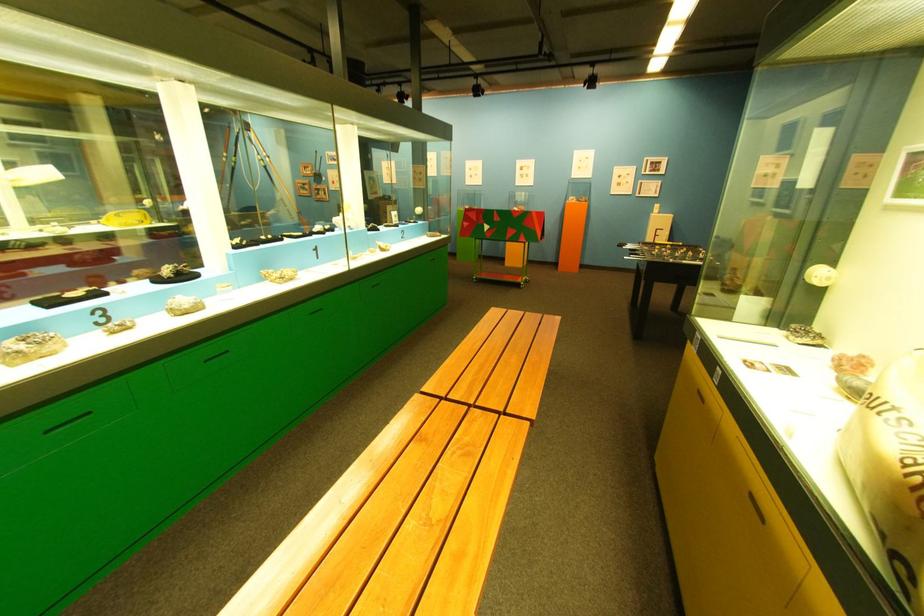
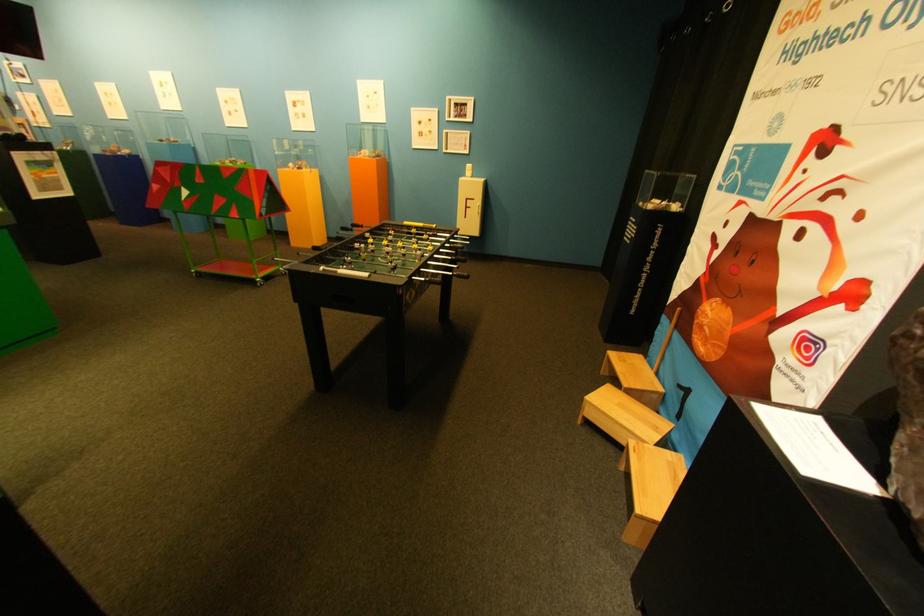
Find the pixel in the second image that matches [492,281] in the first image.

(213, 274)